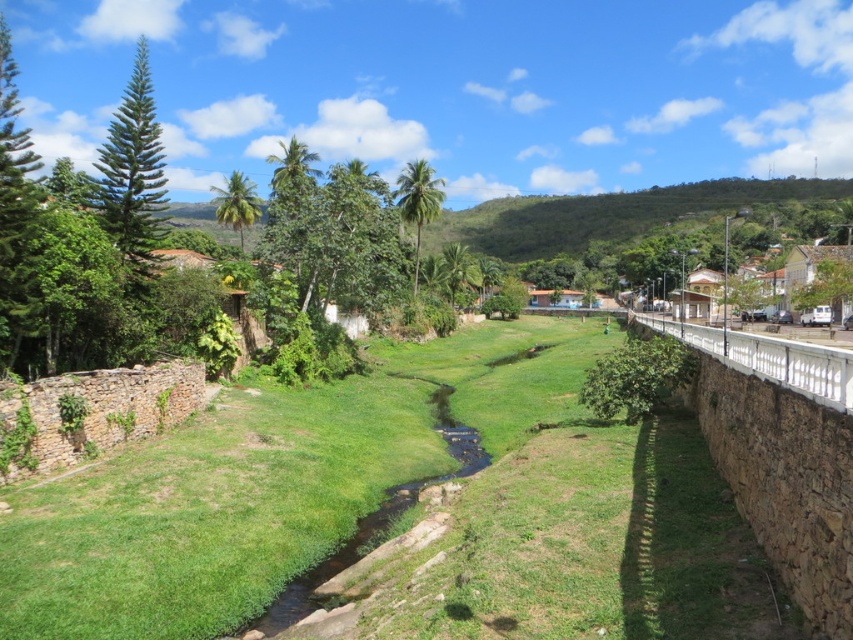
Question: Can you confirm if green grassy at center is bigger than green grassy creek at center?

Choices:
 (A) no
 (B) yes

Answer: (B)

Question: Which point is closer to the camera?

Choices:
 (A) green grassy creek at center
 (B) green grassy at center

Answer: (B)

Question: Does green grassy at center appear on the right side of green grassy creek at center?

Choices:
 (A) no
 (B) yes

Answer: (A)

Question: Which point is closer to the camera?

Choices:
 (A) green grassy creek at center
 (B) green grassy at center

Answer: (B)

Question: Observing the image, what is the correct spatial positioning of green grassy at center in reference to green grassy creek at center?

Choices:
 (A) below
 (B) above

Answer: (B)

Question: Which point is farther to the camera?

Choices:
 (A) green grassy creek at center
 (B) green grassy at center

Answer: (A)